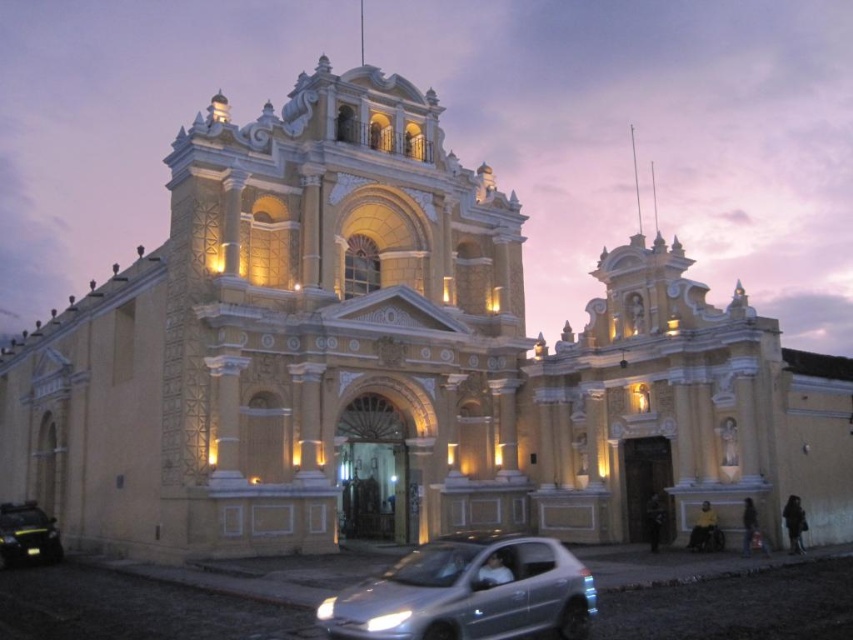
Question: Is silver metallic car at lower center to the right of metallic silver car at lower left from the viewer's perspective?

Choices:
 (A) yes
 (B) no

Answer: (A)

Question: Is silver metallic car at lower center thinner than metallic silver car at lower left?

Choices:
 (A) no
 (B) yes

Answer: (A)

Question: Among these points, which one is nearest to the camera?

Choices:
 (A) (351, 621)
 (B) (33, 515)

Answer: (A)

Question: Is silver metallic car at lower center wider than metallic silver car at lower left?

Choices:
 (A) no
 (B) yes

Answer: (B)